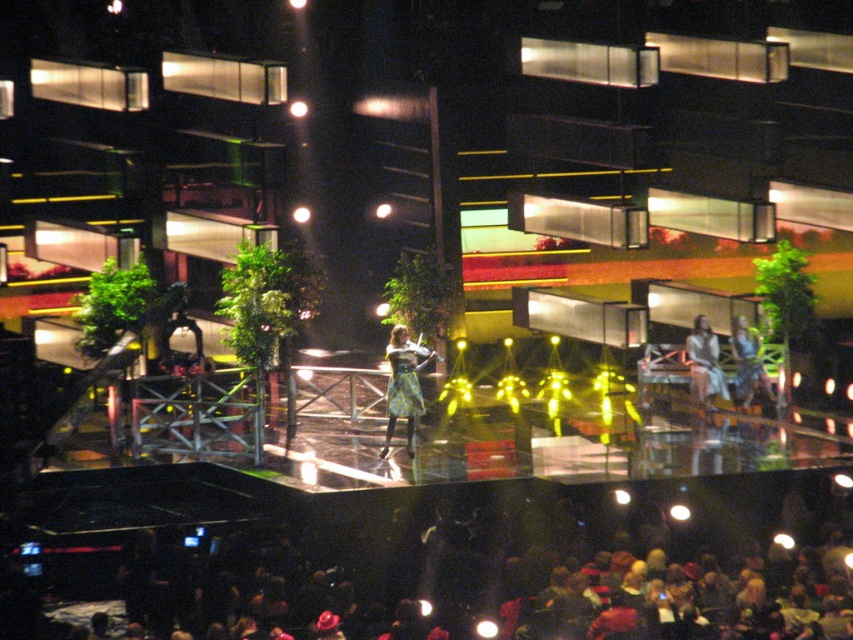
Question: Does dark fabric crowd at lower center lie behind floral dress at center?

Choices:
 (A) no
 (B) yes

Answer: (A)

Question: Is floral-patterned dress at center above floral dress at center?

Choices:
 (A) no
 (B) yes

Answer: (A)

Question: Which is farther from the light brown leather jacket at center?

Choices:
 (A) floral dress at center
 (B) dark fabric crowd at lower center
 (C) floral-patterned dress at center

Answer: (B)

Question: Which point is closer to the camera?

Choices:
 (A) floral dress at center
 (B) dark fabric crowd at lower center
 (C) light brown leather jacket at center
 (D) floral-patterned dress at center

Answer: (B)

Question: Which object appears closest to the camera in this image?

Choices:
 (A) floral-patterned dress at center
 (B) floral dress at center
 (C) dark fabric crowd at lower center

Answer: (C)

Question: Is dark fabric crowd at lower center wider than floral-patterned dress at center?

Choices:
 (A) no
 (B) yes

Answer: (B)